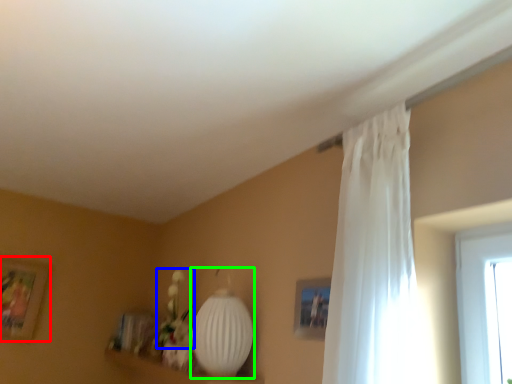
Question: Estimate the real-world distances between objects in this image. Which object is closer to picture frame (highlighted by a red box), floral arrangement (highlighted by a blue box) or lamp (highlighted by a green box)?

Choices:
 (A) floral arrangement
 (B) lamp

Answer: (A)